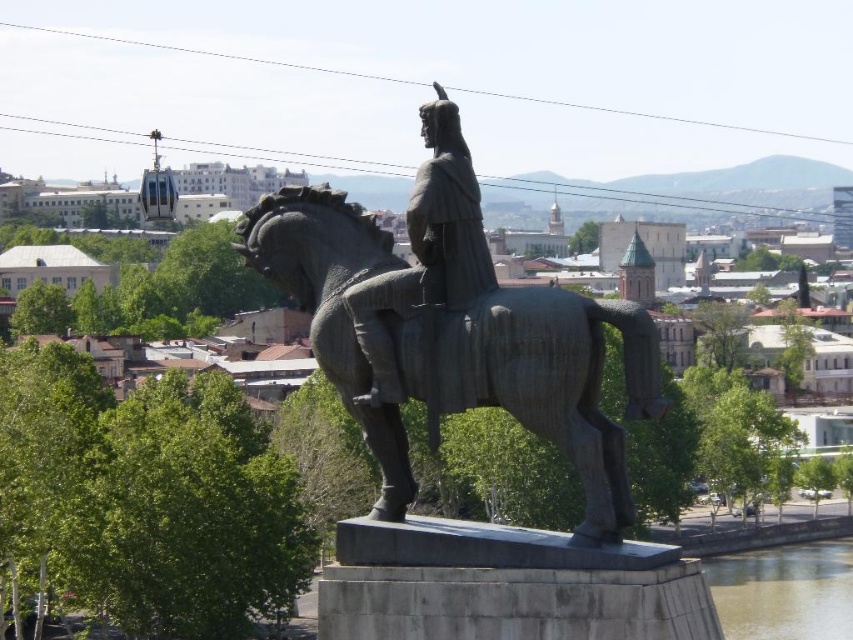
Can you confirm if bronze statue at center is smaller than brown murky water at lower right?

Correct, bronze statue at center occupies less space than brown murky water at lower right.

How much distance is there between bronze statue at center and brown murky water at lower right?

They are 155.51 meters apart.

Locate an element on the screen. This screenshot has width=853, height=640. bronze statue at center is located at coordinates (426, 250).

Where is `bronze statue at center`? The image size is (853, 640). bronze statue at center is located at coordinates click(x=426, y=250).

Based on the photo, can you confirm if bronze textured horse at center is positioned to the left of brown murky water at lower right?

Correct, you'll find bronze textured horse at center to the left of brown murky water at lower right.

Which is more to the left, bronze textured horse at center or brown murky water at lower right?

From the viewer's perspective, bronze textured horse at center appears more on the left side.

Who is more distant from viewer, (548, 333) or (712, 572)?

The point (712, 572) is behind.

Locate an element on the screen. The height and width of the screenshot is (640, 853). bronze textured horse at center is located at coordinates (555, 381).

Is bronze textured horse at center smaller than bronze statue at center?

No.

Does bronze textured horse at center appear on the left side of bronze statue at center?

No, bronze textured horse at center is not to the left of bronze statue at center.

Who is more distant from viewer, (523, 358) or (345, 307)?

Positioned behind is point (345, 307).

Identify the location of bronze textured horse at center. (555, 381).